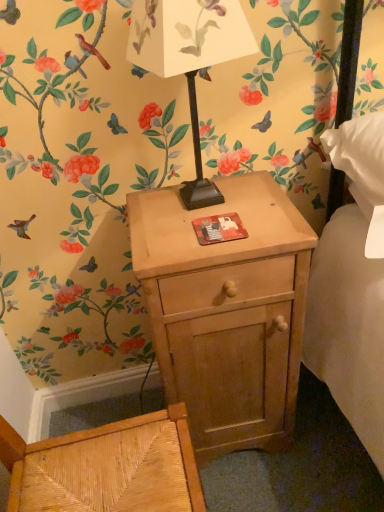
Locate an element on the screen. The width and height of the screenshot is (384, 512). free space above light wood nightstand at center (from a real-world perspective) is located at coordinates (208, 217).